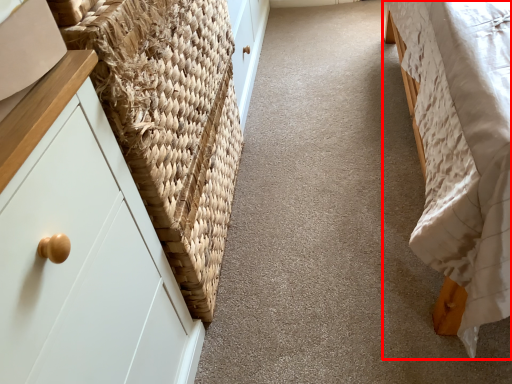
Question: From the image's perspective, where is furniture (annotated by the red box) located relative to basket?

Choices:
 (A) below
 (B) above

Answer: (B)